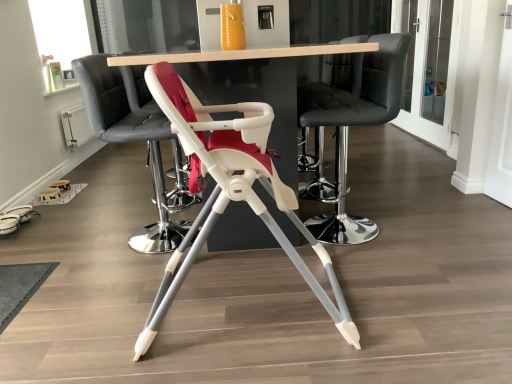
At what (x,y) coordinates should I click in order to perform the action: click on spots to the right of black leather bar stool at center, arranged as the 3th chair when viewed from the back. Please return your answer as a coordinate pair (x, y). Looking at the image, I should click on (428, 223).